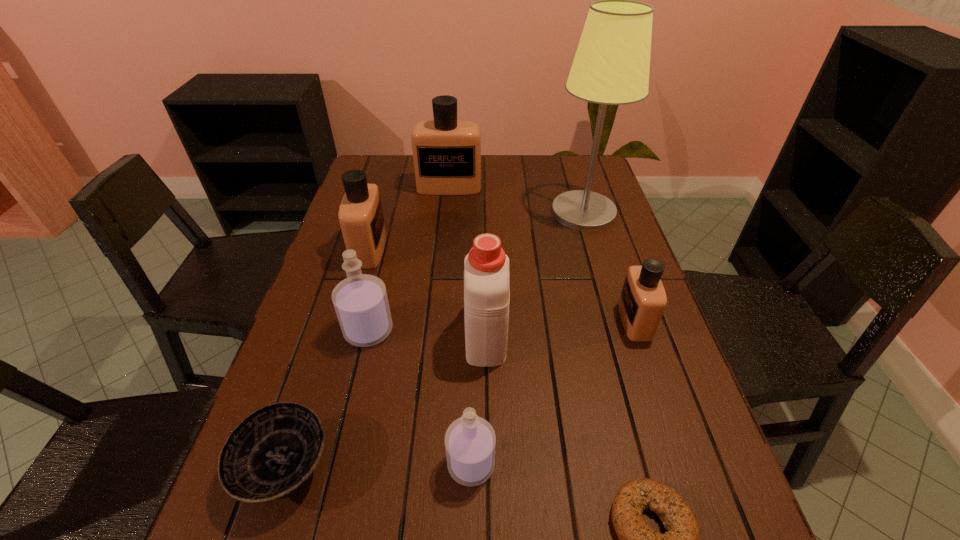
The height and width of the screenshot is (540, 960). Identify the location of the tallest object. (611, 66).

You are a GUI agent. You are given a task and a screenshot of the screen. Output one action in this format:
    pyautogui.click(x=<x>, y=<y>)
    Task: Click on the farthest beige perfume
    The image size is (960, 540).
    Given the screenshot: What is the action you would take?
    pyautogui.click(x=447, y=152)

The height and width of the screenshot is (540, 960). Identify the location of the second beige perfume from right to left. (447, 152).

You are a GUI agent. You are given a task and a screenshot of the screen. Output one action in this format:
    pyautogui.click(x=<x>, y=<y>)
    Task: Click on the detergent
    
    Given the screenshot: What is the action you would take?
    pyautogui.click(x=486, y=267)

This screenshot has height=540, width=960. Find the location of `the farther purple perfume`. the farther purple perfume is located at coordinates (360, 301).

The height and width of the screenshot is (540, 960). What are the coordinates of `the left purple perfume` in the screenshot? It's located at (360, 301).

This screenshot has height=540, width=960. I want to click on the second smallest beige perfume, so click(x=361, y=218).

Locate an element on the screen. the second farthest beige perfume is located at coordinates (361, 218).

Image resolution: width=960 pixels, height=540 pixels. I want to click on the nearest beige perfume, so click(x=642, y=302).

Where is `the rightmost beige perfume`? The width and height of the screenshot is (960, 540). the rightmost beige perfume is located at coordinates (642, 302).